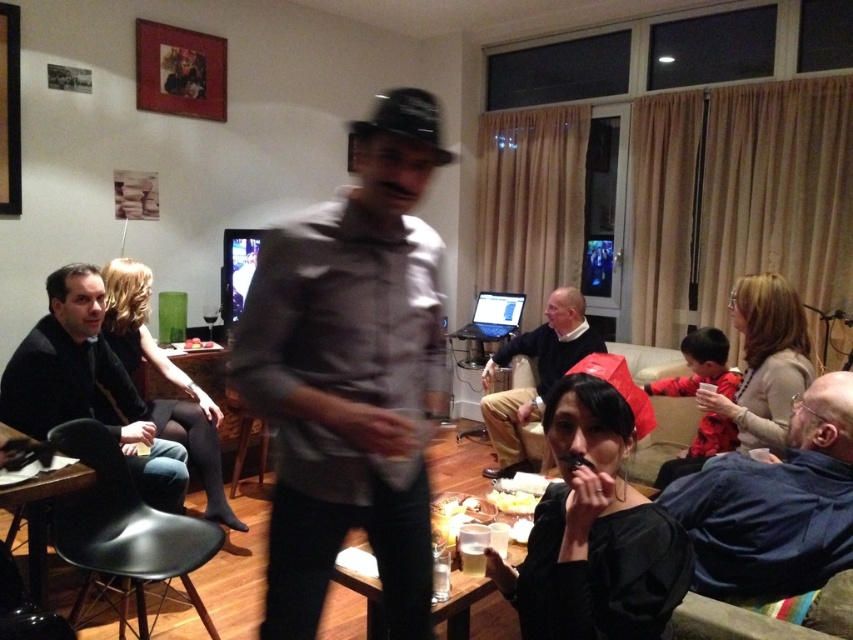
From the picture: Can you confirm if gray matte shirt at center is taller than smooth black shirt at center?

No.

Between gray matte shirt at center and smooth black shirt at center, which one has more height?

With more height is smooth black shirt at center.

Locate an element on the screen. This screenshot has width=853, height=640. gray matte shirt at center is located at coordinates (350, 372).

Which is behind, point (32, 419) or point (518, 497)?

The point (518, 497) is behind.

Which is below, black leather jacket at lower left or yellow matte cheese at center?

Positioned lower is yellow matte cheese at center.

Does point (143, 413) come behind point (527, 500)?

Yes.

Find the location of `black leather jacket at lower left`. black leather jacket at lower left is located at coordinates (86, 385).

Is gray matte shirt at center to the left of yellow matte cheese at center from the viewer's perspective?

Correct, you'll find gray matte shirt at center to the left of yellow matte cheese at center.

Who is positioned more to the right, gray matte shirt at center or yellow matte cheese at center?

yellow matte cheese at center is more to the right.

Is point (306, 508) positioned before point (520, 496)?

Yes, it is.

At what (x,y) coordinates should I click in order to perform the action: click on gray matte shirt at center. Please return your answer as a coordinate pair (x, y). This screenshot has width=853, height=640. Looking at the image, I should click on (350, 372).